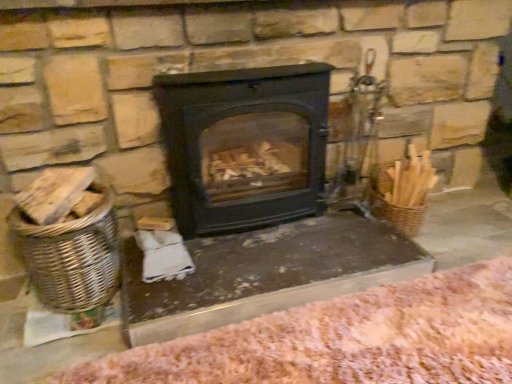
Question: From the image's perspective, is pink woolen blanket at lower right above woven brown basket at left?

Choices:
 (A) no
 (B) yes

Answer: (A)

Question: From the image's perspective, is pink woolen blanket at lower right beneath woven brown basket at left?

Choices:
 (A) yes
 (B) no

Answer: (A)

Question: Is pink woolen blanket at lower right bigger than woven brown basket at left?

Choices:
 (A) yes
 (B) no

Answer: (A)

Question: Is pink woolen blanket at lower right to the left of woven brown basket at left from the viewer's perspective?

Choices:
 (A) yes
 (B) no

Answer: (B)

Question: Considering the relative sizes of pink woolen blanket at lower right and woven brown basket at left in the image provided, is pink woolen blanket at lower right thinner than woven brown basket at left?

Choices:
 (A) yes
 (B) no

Answer: (B)

Question: In terms of size, does black matte wood burning stove at center appear bigger or smaller than pink woolen blanket at lower right?

Choices:
 (A) small
 (B) big

Answer: (B)

Question: Considering the positions of black matte wood burning stove at center and pink woolen blanket at lower right in the image, is black matte wood burning stove at center wider or thinner than pink woolen blanket at lower right?

Choices:
 (A) thin
 (B) wide

Answer: (A)

Question: Is point (202, 208) positioned closer to the camera than point (220, 372)?

Choices:
 (A) closer
 (B) farther

Answer: (B)

Question: Is black matte wood burning stove at center taller or shorter than pink woolen blanket at lower right?

Choices:
 (A) short
 (B) tall

Answer: (B)

Question: Is point (83, 301) closer or farther from the camera than point (267, 228)?

Choices:
 (A) closer
 (B) farther

Answer: (A)

Question: From the image's perspective, relative to smooth stone table at center, is woven brown basket at left above or below?

Choices:
 (A) above
 (B) below

Answer: (A)

Question: Looking at their shapes, would you say woven brown basket at left is wider or thinner than smooth stone table at center?

Choices:
 (A) wide
 (B) thin

Answer: (B)

Question: Choose the correct answer: Is woven brown basket at left inside smooth stone table at center or outside it?

Choices:
 (A) inside
 (B) outside

Answer: (B)

Question: Is point (291, 264) closer or farther from the camera than point (33, 264)?

Choices:
 (A) farther
 (B) closer

Answer: (A)

Question: Considering the positions of smooth stone table at center and woven brown basket at left in the image, is smooth stone table at center taller or shorter than woven brown basket at left?

Choices:
 (A) short
 (B) tall

Answer: (A)